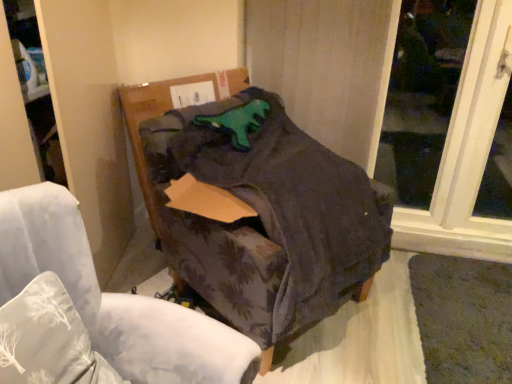
This screenshot has height=384, width=512. Identify the location of purple floral fabric chair at center. (94, 311).

What do you see at coordinates (257, 208) in the screenshot? I see `dark fabric chair at center` at bounding box center [257, 208].

Identify the location of transparent glass window at upper right. (451, 114).

Measure the distance between point (149, 191) and camera.

Point (149, 191) is 5.95 feet from camera.

What is the approximate height of white fabric pillow at lower left?

white fabric pillow at lower left is 17.84 inches tall.

Measure the distance between white fabric pillow at lower left and camera.

A distance of 29.88 inches exists between white fabric pillow at lower left and camera.

Identify the location of purple floral fabric chair at center. The height and width of the screenshot is (384, 512). (94, 311).

Measure the distance between transparent glass window at upper right and purple floral fabric chair at center.

A distance of 6.55 feet exists between transparent glass window at upper right and purple floral fabric chair at center.

Does transparent glass window at upper right turn towards purple floral fabric chair at center?

No, transparent glass window at upper right is not aimed at purple floral fabric chair at center.

Based on their positions, is transparent glass window at upper right located to the left or right of purple floral fabric chair at center?

Clearly, transparent glass window at upper right is on the right of purple floral fabric chair at center in the image.

Considering the sizes of objects transparent glass window at upper right and purple floral fabric chair at center in the image provided, who is smaller, transparent glass window at upper right or purple floral fabric chair at center?

transparent glass window at upper right is smaller.

Where is `pillow behind the purple floral fabric chair at center`? The image size is (512, 384). pillow behind the purple floral fabric chair at center is located at coordinates (48, 339).

Is point (55, 366) behind point (68, 345)?

No, (55, 366) is in front of (68, 345).

Is purple floral fabric chair at center inside or outside of white fabric pillow at lower left?

purple floral fabric chair at center is outside white fabric pillow at lower left.

Could you tell me if cardboard box at center is turned towards dark fabric chair at center?

Yes, cardboard box at center faces towards dark fabric chair at center.

Considering the positions of objects cardboard box at center and dark fabric chair at center in the image provided, who is more to the right, cardboard box at center or dark fabric chair at center?

dark fabric chair at center.

What's the angular difference between cardboard box at center and dark fabric chair at center's facing directions?

43.3 degrees separate the facing orientations of cardboard box at center and dark fabric chair at center.

Considering the sizes of cardboard box at center and dark fabric chair at center in the image, is cardboard box at center taller or shorter than dark fabric chair at center?

cardboard box at center is shorter than dark fabric chair at center.

Between cardboard box at center and transparent glass window at upper right, which one has smaller size?

transparent glass window at upper right.

Which object is positioned more to the right, cardboard box at center or transparent glass window at upper right?

From the viewer's perspective, transparent glass window at upper right appears more on the right side.

Identify the location of window behind the cardboard box at center. (451, 114).

Is cardboard box at center directly adjacent to transparent glass window at upper right?

There is a gap between cardboard box at center and transparent glass window at upper right.

Identify the location of furniture below the cardboard box at center (from a real-world perspective). The height and width of the screenshot is (384, 512). (257, 208).

From a real-world perspective, is dark fabric chair at center beneath cardboard box at center?

Yes, from a real-world perspective, dark fabric chair at center is under cardboard box at center.

Could you tell me if dark fabric chair at center is turned towards cardboard box at center?

No.

From the image's perspective, is dark fabric chair at center above or below cardboard box at center?

Clearly, from the image's perspective, dark fabric chair at center is below cardboard box at center.

How different are the orientations of purple floral fabric chair at center and cardboard box at center in degrees?

There is a 60.2-degree angle between the facing directions of purple floral fabric chair at center and cardboard box at center.

Is purple floral fabric chair at center wider or thinner than cardboard box at center?

In the image, purple floral fabric chair at center appears to be wider than cardboard box at center.

Which object is further away from the camera, purple floral fabric chair at center or cardboard box at center?

cardboard box at center is further from the camera.

Considering the relative positions of purple floral fabric chair at center and cardboard box at center in the image provided, is purple floral fabric chair at center to the right of cardboard box at center from the viewer's perspective?

Yes, purple floral fabric chair at center is to the right of cardboard box at center.

Is purple floral fabric chair at center to the left or to the right of transparent glass window at upper right in the image?

From the image, it's evident that purple floral fabric chair at center is to the left of transparent glass window at upper right.

Between purple floral fabric chair at center and transparent glass window at upper right, which one has smaller size?

With smaller size is transparent glass window at upper right.

Is point (51, 202) farther from viewer compared to point (486, 88)?

No, it is in front of (486, 88).

Who is shorter, purple floral fabric chair at center or transparent glass window at upper right?

purple floral fabric chair at center is shorter.

You are a GUI agent. You are given a task and a screenshot of the screen. Output one action in this format:
    pyautogui.click(x=<x>, y=<y>)
    Task: Click on the chair that is on the left side of transparent glass window at upper right
    The width and height of the screenshot is (512, 384).
    Given the screenshot: What is the action you would take?
    pyautogui.click(x=94, y=311)

I want to click on chair below the white fabric pillow at lower left (from a real-world perspective), so click(x=94, y=311).

From the image, which object appears to be nearer to white fabric pillow at lower left, dark fabric chair at center or purple floral fabric chair at center?

purple floral fabric chair at center is closer to white fabric pillow at lower left.

In the scene shown: From the image, which object appears to be nearer to cardboard box at center, dark fabric chair at center or purple floral fabric chair at center?

Among the two, dark fabric chair at center is located nearer to cardboard box at center.

Estimate the real-world distances between objects in this image. Which object is further from purple floral fabric chair at center, cardboard box at center or dark fabric chair at center?

Based on the image, cardboard box at center appears to be further to purple floral fabric chair at center.

When comparing their distances from dark fabric chair at center, does purple floral fabric chair at center or cardboard box at center seem closer?

The object closer to dark fabric chair at center is cardboard box at center.

Which object lies nearer to the anchor point cardboard box at center, purple floral fabric chair at center or transparent glass window at upper right?

Based on the image, purple floral fabric chair at center appears to be nearer to cardboard box at center.

From the image, which object appears to be farther from dark fabric chair at center, white fabric pillow at lower left or purple floral fabric chair at center?

Based on the image, white fabric pillow at lower left appears to be further to dark fabric chair at center.

Estimate the real-world distances between objects in this image. Which object is closer to white fabric pillow at lower left, purple floral fabric chair at center or cardboard box at center?

The object closer to white fabric pillow at lower left is purple floral fabric chair at center.

From the image, which object appears to be nearer to cardboard box at center, transparent glass window at upper right or dark fabric chair at center?

dark fabric chair at center is positioned closer to the anchor cardboard box at center.

Where is `cardboard box positioned between purple floral fabric chair at center and transparent glass window at upper right from near to far`? cardboard box positioned between purple floral fabric chair at center and transparent glass window at upper right from near to far is located at coordinates (168, 110).

You are a GUI agent. You are given a task and a screenshot of the screen. Output one action in this format:
    pyautogui.click(x=<x>, y=<y>)
    Task: Click on the pillow between purple floral fabric chair at center and dark fabric chair at center in the front-back direction
    Image resolution: width=512 pixels, height=384 pixels.
    Given the screenshot: What is the action you would take?
    pyautogui.click(x=48, y=339)

I want to click on furniture between cardboard box at center and transparent glass window at upper right in the horizontal direction, so click(x=257, y=208).

Identify the location of furniture located between white fabric pillow at lower left and transparent glass window at upper right in the depth direction. This screenshot has height=384, width=512. (257, 208).